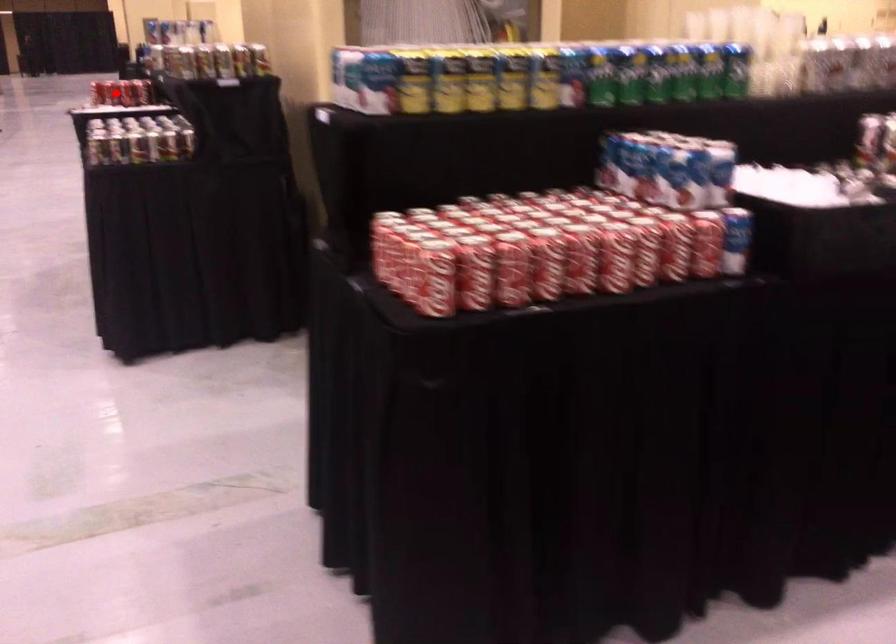
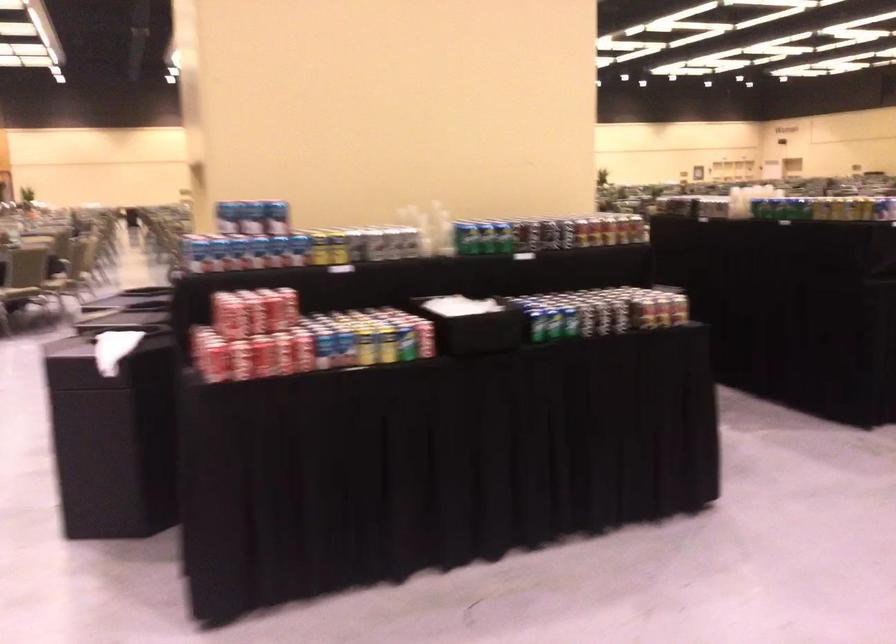
Where in the second image is the point corresponding to the highlighted location from the first image?

(386, 345)